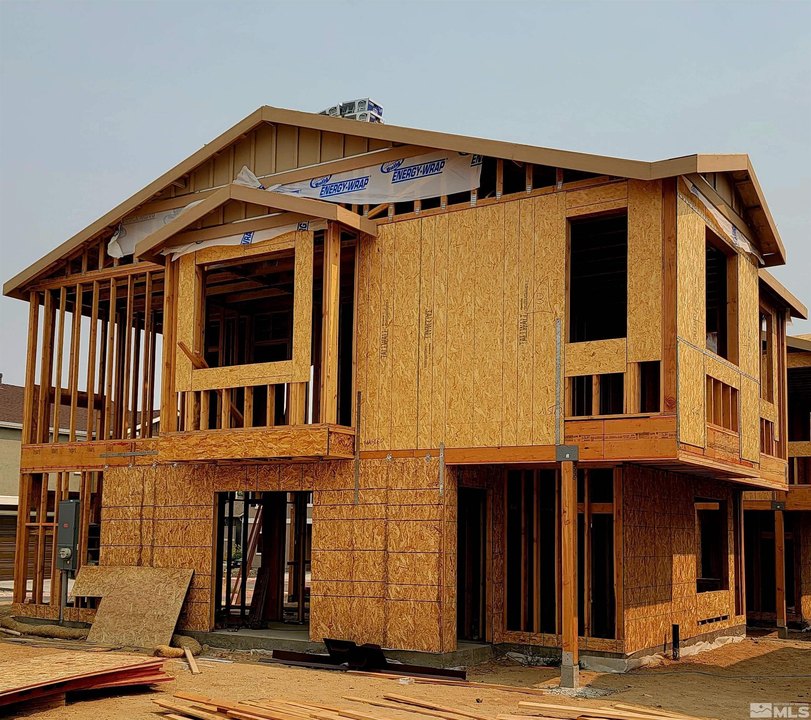
Locate an element on the screen. This screenshot has width=811, height=720. frame is located at coordinates (367, 523).